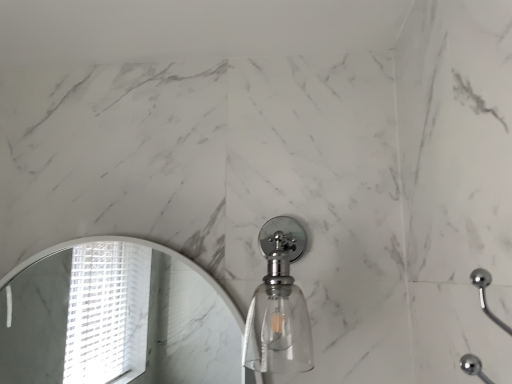
Question: Is clear glass soap dispenser at center to the left or to the right of white marble mirror at upper left in the image?

Choices:
 (A) right
 (B) left

Answer: (A)

Question: Is clear glass soap dispenser at center inside the boundaries of white marble mirror at upper left, or outside?

Choices:
 (A) inside
 (B) outside

Answer: (B)

Question: Is clear glass soap dispenser at center wider or thinner than white marble mirror at upper left?

Choices:
 (A) wide
 (B) thin

Answer: (A)

Question: Would you say white marble mirror at upper left is inside or outside clear glass soap dispenser at center?

Choices:
 (A) inside
 (B) outside

Answer: (B)

Question: Considering their positions, is white marble mirror at upper left located in front of or behind clear glass soap dispenser at center?

Choices:
 (A) front
 (B) behind

Answer: (B)

Question: From the image's perspective, is white marble mirror at upper left above or below clear glass soap dispenser at center?

Choices:
 (A) below
 (B) above

Answer: (A)

Question: Is white marble mirror at upper left wider or thinner than clear glass soap dispenser at center?

Choices:
 (A) wide
 (B) thin

Answer: (B)